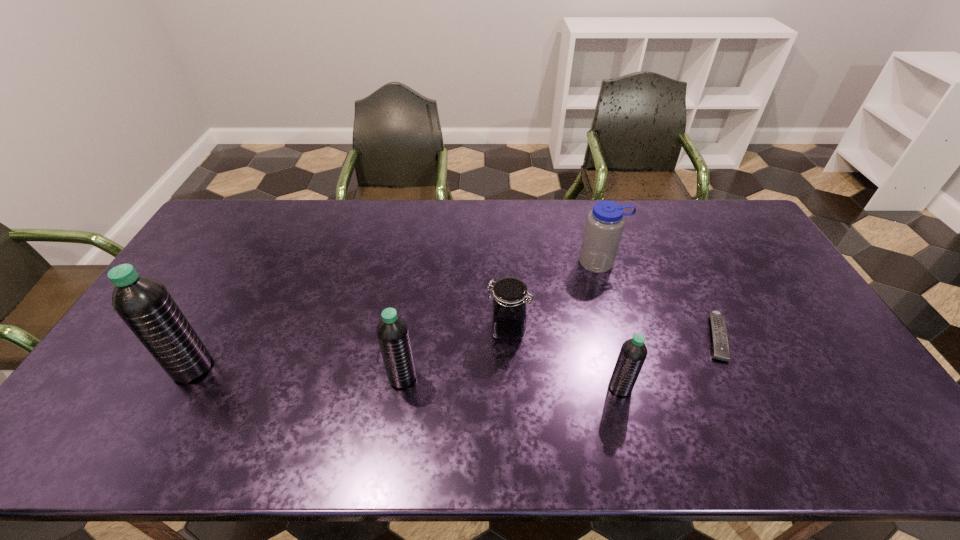
Identify the location of the tallest water bottle. tap(144, 304).

Where is `the leftmost object`? The height and width of the screenshot is (540, 960). the leftmost object is located at coordinates (144, 304).

Find the location of `the third water bottle from right to left`. the third water bottle from right to left is located at coordinates (392, 331).

I want to click on the farthest object, so click(x=605, y=223).

Where is `the shortest object`? This screenshot has height=540, width=960. the shortest object is located at coordinates (721, 351).

In order to click on the rightmost object in this screenshot , I will do [x=721, y=351].

Locate an element on the screen. The width and height of the screenshot is (960, 540). jar is located at coordinates (509, 300).

At what (x,y) coordinates should I click in order to perform the action: click on the fourth object from right to left. Please return your answer as a coordinate pair (x, y). The image size is (960, 540). Looking at the image, I should click on click(509, 300).

Locate an element on the screen. The width and height of the screenshot is (960, 540). free space located on the left of the leftmost water bottle is located at coordinates (147, 368).

This screenshot has height=540, width=960. Identify the location of free spot located 0.200m on the back of the fifth object from right to left. (412, 309).